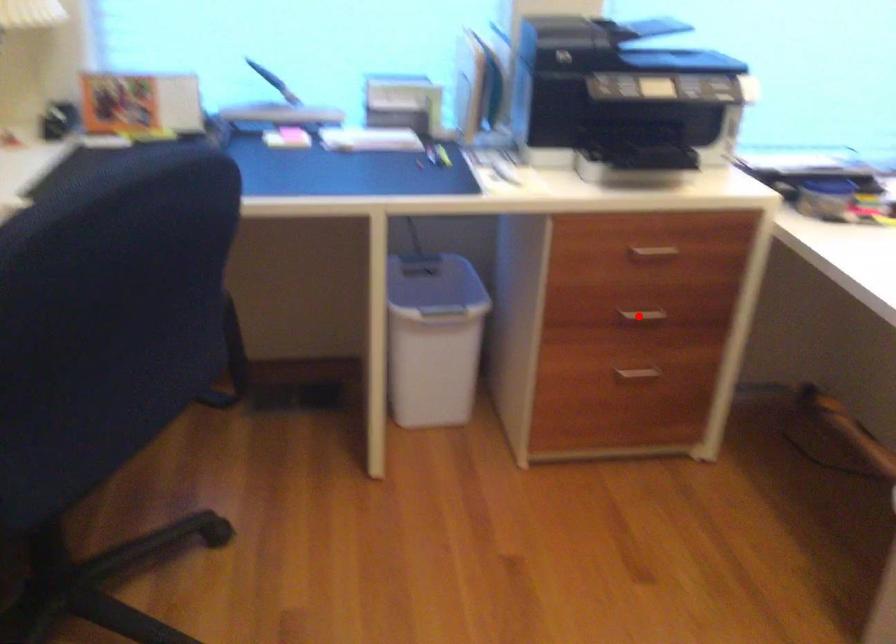
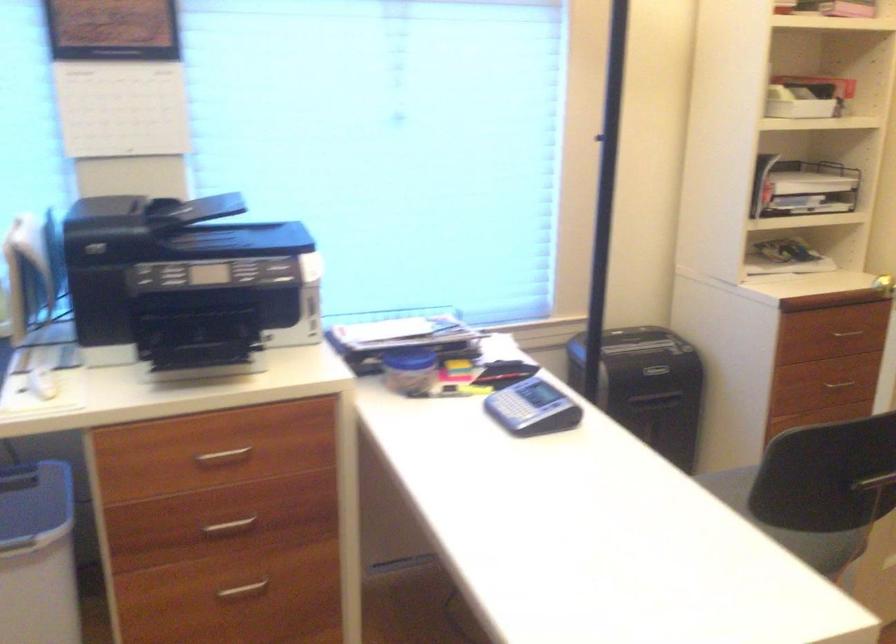
The point at the highlighted location is marked in the first image. Where is the corresponding point in the second image?

(228, 527)